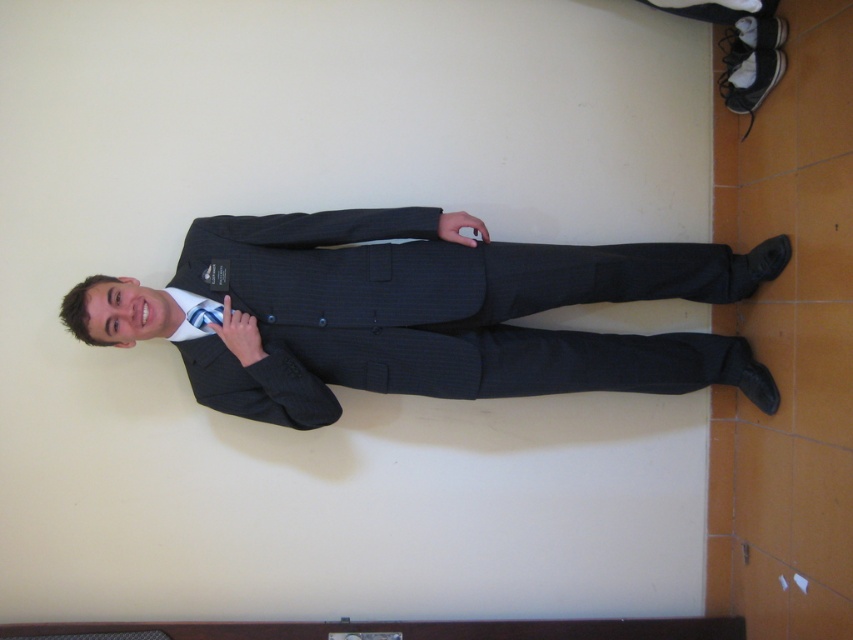
Which is more to the right, pinstriped fabric business suit at center or silky blue tie at center?

Positioned to the right is pinstriped fabric business suit at center.

Between pinstriped fabric business suit at center and silky blue tie at center, which one is positioned lower?

pinstriped fabric business suit at center is lower down.

Does point (253, 305) come in front of point (207, 316)?

Yes.

Locate an element on the screen. This screenshot has width=853, height=640. pinstriped fabric business suit at center is located at coordinates (434, 314).